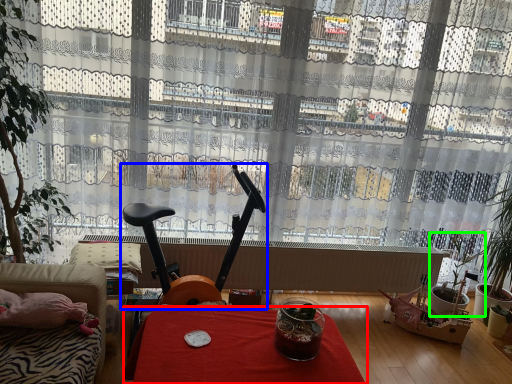
Question: Based on their relative distances, which object is farther from table (highlighted by a red box)? Choose from swivel chair (highlighted by a blue box) and houseplant (highlighted by a green box).

Choices:
 (A) swivel chair
 (B) houseplant

Answer: (B)